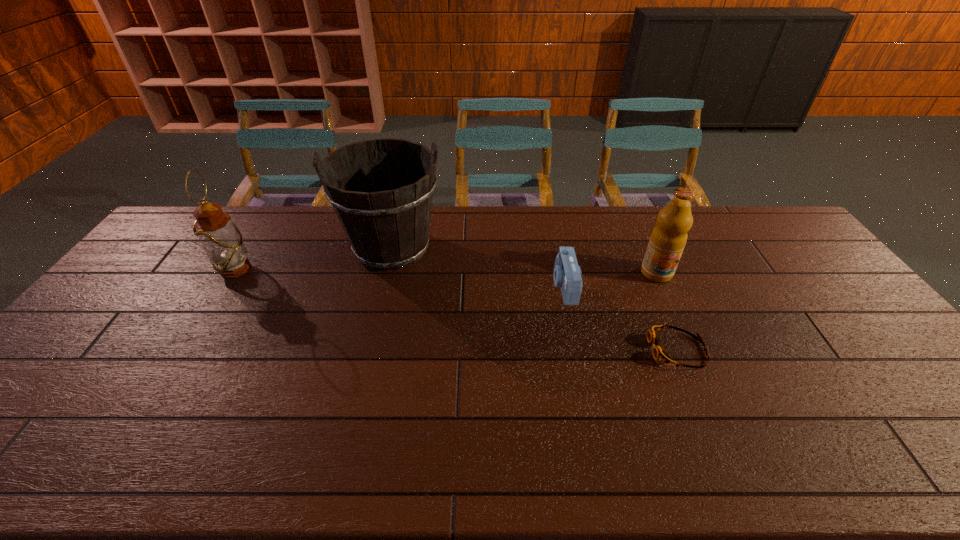
Where is `free spot located on the lens of the camera`? This screenshot has width=960, height=540. free spot located on the lens of the camera is located at coordinates (528, 286).

The height and width of the screenshot is (540, 960). I want to click on free location located 0.320m on the lens of the camera, so click(450, 286).

The height and width of the screenshot is (540, 960). In order to click on vacant space situated 0.060m on the lens of the camera in this screenshot , I will do `click(535, 286)`.

Locate an element on the screen. Image resolution: width=960 pixels, height=540 pixels. free space located 0.180m with the lenses facing forward on the nearest object is located at coordinates (582, 350).

I want to click on free space located with the lenses facing forward on the nearest object, so (x=571, y=350).

Locate an element on the screen. This screenshot has height=540, width=960. free space located 0.260m with the lenses facing forward on the nearest object is located at coordinates (552, 350).

This screenshot has height=540, width=960. In order to click on object located in the far edge section of the desktop in this screenshot , I will do `click(387, 225)`.

Identify the location of free space at the far edge of the desktop. The width and height of the screenshot is (960, 540). [x=530, y=227].

At what (x,y) coordinates should I click in order to perform the action: click on vacant space at the near edge of the desktop. Please return your answer as a coordinate pair (x, y). Image resolution: width=960 pixels, height=540 pixels. Looking at the image, I should click on (566, 443).

Locate an element on the screen. The height and width of the screenshot is (540, 960). free region at the left edge is located at coordinates [171, 262].